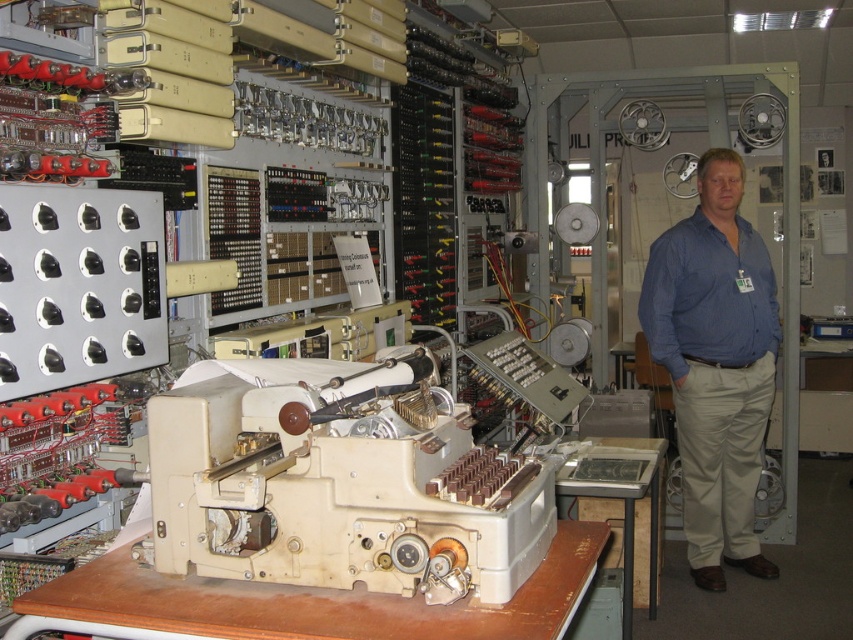
Is beige plastic typewriter at center wider than blue cotton shirt at right?

Yes, beige plastic typewriter at center is wider than blue cotton shirt at right.

Between beige plastic typewriter at center and blue cotton shirt at right, which one is positioned higher?

Positioned higher is blue cotton shirt at right.

You are a GUI agent. You are given a task and a screenshot of the screen. Output one action in this format:
    pyautogui.click(x=<x>, y=<y>)
    Task: Click on the beige plastic typewriter at center
    
    Given the screenshot: What is the action you would take?
    pyautogui.click(x=339, y=481)

Who is positioned more to the right, blue shirt at center or blue cotton shirt at right?

From the viewer's perspective, blue shirt at center appears more on the right side.

Locate an element on the screen. Image resolution: width=853 pixels, height=640 pixels. blue shirt at center is located at coordinates (715, 364).

Is beige wood workbench at center smaller than blue cotton shirt at right?

Indeed, beige wood workbench at center has a smaller size compared to blue cotton shirt at right.

Does beige wood workbench at center have a larger size compared to blue cotton shirt at right?

No, beige wood workbench at center is not bigger than blue cotton shirt at right.

Which is behind, point (476, 611) or point (769, 326)?

Positioned behind is point (769, 326).

Image resolution: width=853 pixels, height=640 pixels. Find the location of `beige wood workbench at center`. beige wood workbench at center is located at coordinates (300, 604).